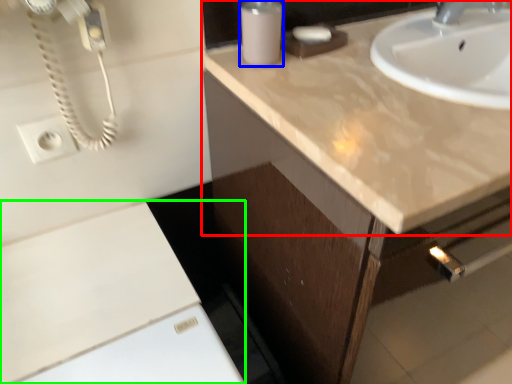
Question: Which object is positioned closest to countertop (highlighted by a red box)? Select from soap dispenser (highlighted by a blue box) and cabinetry (highlighted by a green box).

Choices:
 (A) soap dispenser
 (B) cabinetry

Answer: (A)